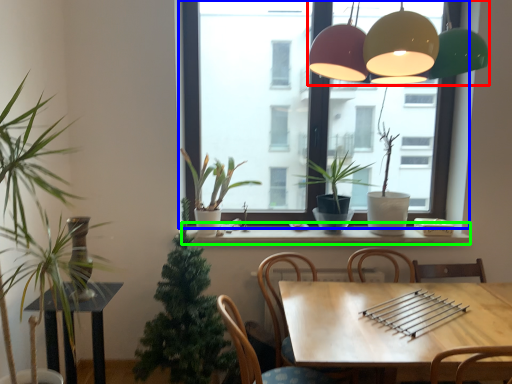
Question: Which object is positioned farthest from lamp (highlighted by a red box)? Select from window (highlighted by a blue box) and window sill (highlighted by a green box).

Choices:
 (A) window
 (B) window sill

Answer: (A)